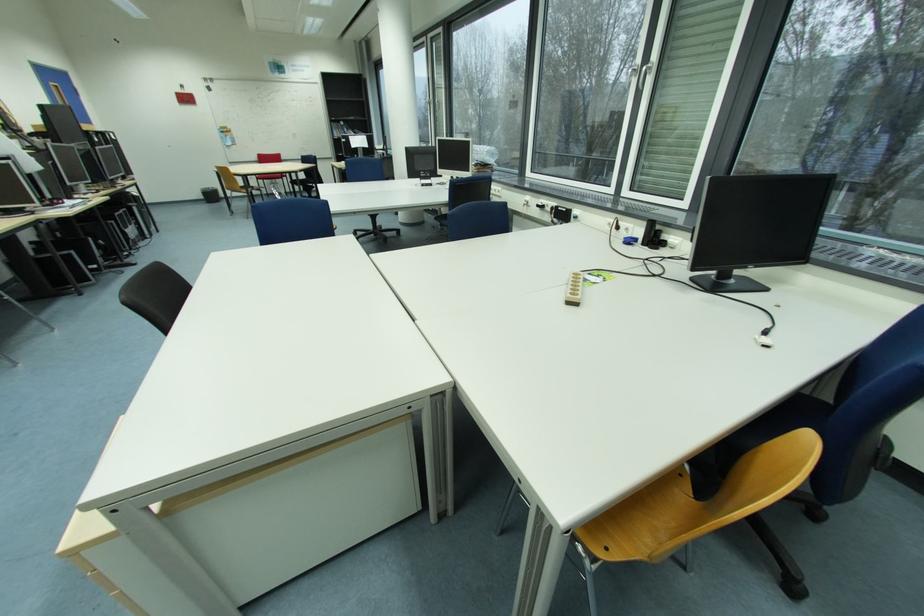
Find the location of a particular element. The width and height of the screenshot is (924, 616). yellow chair sitting surface is located at coordinates (641, 521).